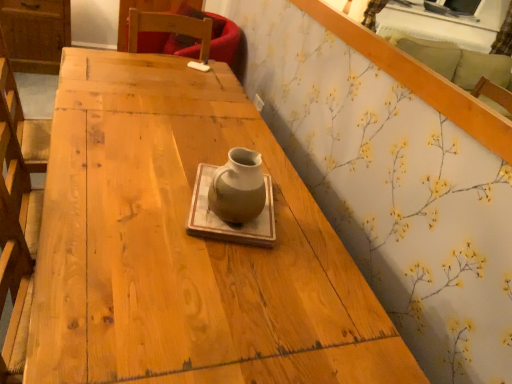
Question: Is white floral wallpaper at upper right shorter than matte ceramic vase at center?

Choices:
 (A) yes
 (B) no

Answer: (B)

Question: Is white floral wallpaper at upper right touching matte ceramic vase at center?

Choices:
 (A) no
 (B) yes

Answer: (A)

Question: Does white floral wallpaper at upper right turn towards matte ceramic vase at center?

Choices:
 (A) yes
 (B) no

Answer: (B)

Question: From a real-world perspective, is white floral wallpaper at upper right under matte ceramic vase at center?

Choices:
 (A) yes
 (B) no

Answer: (B)

Question: Can you confirm if white floral wallpaper at upper right is wider than matte ceramic vase at center?

Choices:
 (A) no
 (B) yes

Answer: (A)

Question: Is matte ceramic vase at center at the back of white floral wallpaper at upper right?

Choices:
 (A) no
 (B) yes

Answer: (A)

Question: From the image's perspective, is matte ceramic vase at center located above white floral wallpaper at upper right?

Choices:
 (A) yes
 (B) no

Answer: (B)

Question: Is matte ceramic vase at center wider than white floral wallpaper at upper right?

Choices:
 (A) yes
 (B) no

Answer: (A)

Question: Are matte ceramic vase at center and white floral wallpaper at upper right located far from each other?

Choices:
 (A) yes
 (B) no

Answer: (B)

Question: From the image's perspective, is matte ceramic vase at center under white floral wallpaper at upper right?

Choices:
 (A) yes
 (B) no

Answer: (A)

Question: Is matte ceramic vase at center oriented away from white floral wallpaper at upper right?

Choices:
 (A) no
 (B) yes

Answer: (A)

Question: Can you confirm if matte ceramic vase at center is positioned to the right of white floral wallpaper at upper right?

Choices:
 (A) yes
 (B) no

Answer: (B)

Question: From a real-world perspective, is white floral wallpaper at upper right physically located above or below matte ceramic vase at center?

Choices:
 (A) above
 (B) below

Answer: (A)